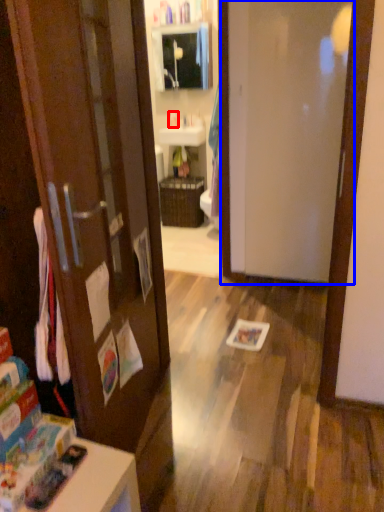
Question: Which object is further to the camera taking this photo, toiletry (highlighted by a red box) or door (highlighted by a blue box)?

Choices:
 (A) toiletry
 (B) door

Answer: (A)